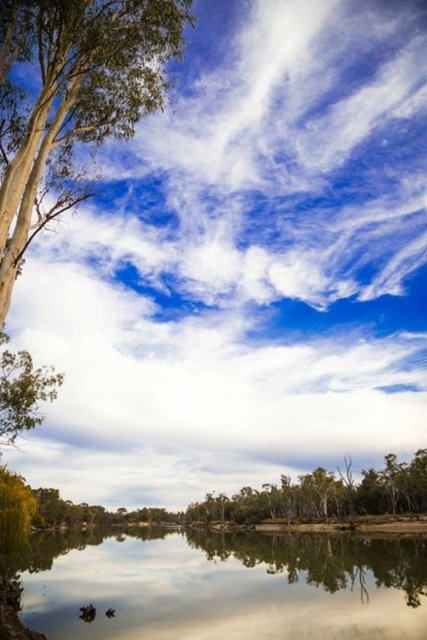
Question: Which point appears closest to the camera in this image?

Choices:
 (A) (245, 540)
 (B) (421, 579)

Answer: (B)

Question: Observing the image, what is the correct spatial positioning of reflective glass water at lower center in reference to smooth water at lower center?

Choices:
 (A) below
 (B) above

Answer: (A)

Question: From the image, what is the correct spatial relationship of reflective glass water at lower center in relation to smooth water at lower center?

Choices:
 (A) left
 (B) right

Answer: (A)

Question: Which point is farther to the camera?

Choices:
 (A) reflective glass water at lower center
 (B) smooth water at lower center

Answer: (B)

Question: Which of the following is the closest to the observer?

Choices:
 (A) [341, 579]
 (B) [394, 625]

Answer: (B)

Question: Can you confirm if reflective glass water at lower center is positioned below smooth water at lower center?

Choices:
 (A) no
 (B) yes

Answer: (B)